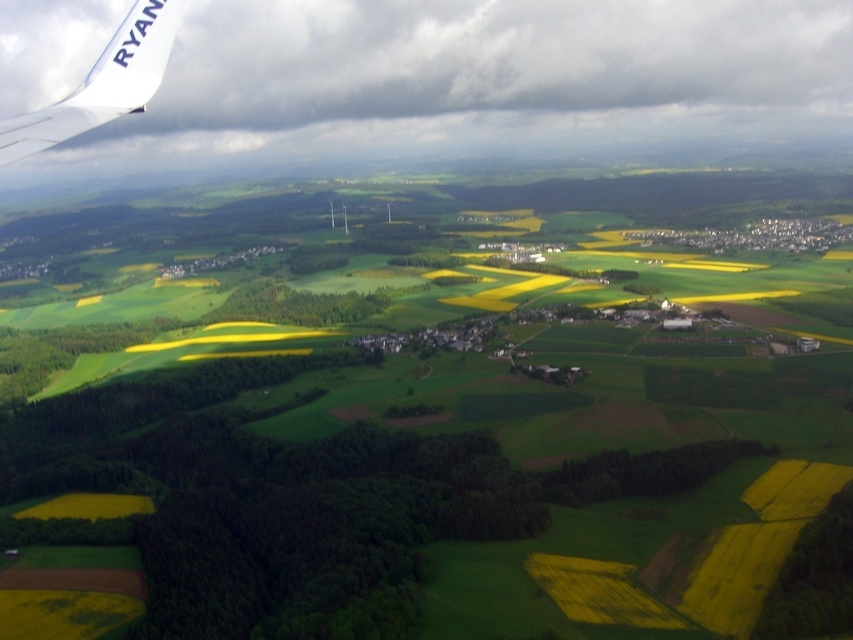
You are a pilot flying over a rural area and notice a specific point at coordinates (485, 80). Based on the scene below, what is located at that point?

The point at coordinates (485, 80) is on a white fluffy cloud at upper left.

You are a passenger on a flight and notice the white fluffy cloud at upper left and the white matte airplane wing at upper left through the window. Which object appears bigger in your view?

The white fluffy cloud at upper left appears bigger because it has a larger size compared to the white matte airplane wing at upper left.